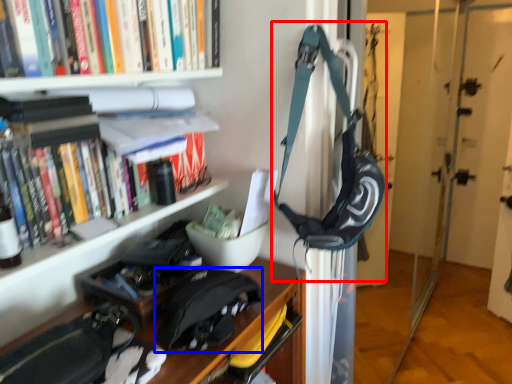
Question: Among these objects, which one is nearest to the camera, shoulder bag (highlighted by a red box) or messenger bag (highlighted by a blue box)?

Choices:
 (A) shoulder bag
 (B) messenger bag

Answer: (B)